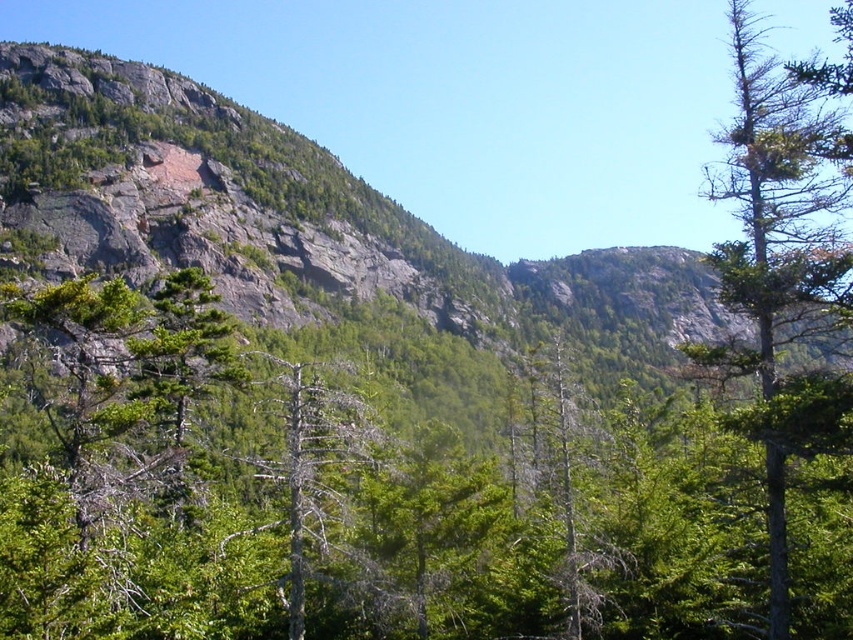
Which of these two, green needle-like at right or gray bark tree at center, stands taller?

Standing taller between the two is green needle-like at right.

Is point (790, 161) less distant than point (364, 452)?

Yes, point (790, 161) is in front of point (364, 452).

Locate an element on the screen. The height and width of the screenshot is (640, 853). green needle-like at right is located at coordinates (776, 241).

Who is more distant from viewer, [131,612] or [758,42]?

The point [758,42] is behind.

Consider the image. Can you confirm if green leafy tree at center is shorter than green needle-like at right?

Yes.

Which is in front, point (610, 429) or point (834, 241)?

Positioned in front is point (834, 241).

At what (x,y) coordinates should I click in order to perform the action: click on green leafy tree at center. Please return your answer as a coordinate pair (x, y). The image size is (853, 640). Looking at the image, I should click on (387, 493).

What do you see at coordinates (387, 493) in the screenshot?
I see `green leafy tree at center` at bounding box center [387, 493].

Can you confirm if green leafy tree at center is bigger than gray bark tree at center?

Yes.

Describe the element at coordinates (387, 493) in the screenshot. I see `green leafy tree at center` at that location.

Image resolution: width=853 pixels, height=640 pixels. Identify the location of green leafy tree at center. (387, 493).